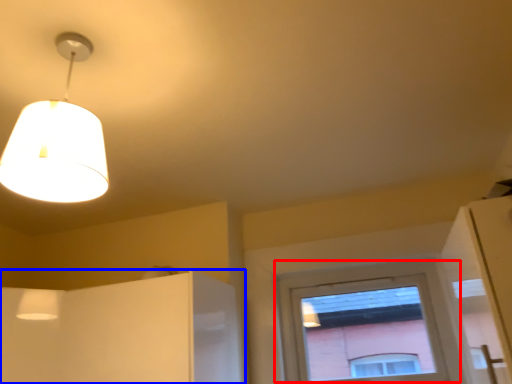
Question: Among these objects, which one is farthest to the camera, window (highlighted by a red box) or cabinetry (highlighted by a blue box)?

Choices:
 (A) window
 (B) cabinetry

Answer: (A)